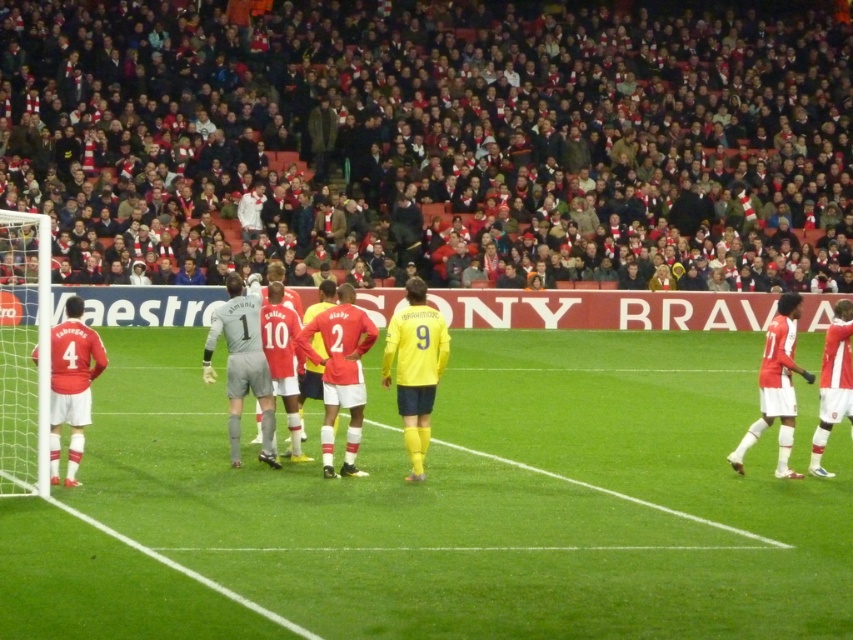
Question: Does red scarf at upper center have a greater width compared to yellow matte jersey at center?

Choices:
 (A) yes
 (B) no

Answer: (A)

Question: Which point is farther to the camera?

Choices:
 (A) green grass field at lower left
 (B) yellow matte jersey at center
 (C) white plastic goal at left

Answer: (B)

Question: Is white plastic goal at left thinner than yellow matte jersey at center?

Choices:
 (A) yes
 (B) no

Answer: (B)

Question: Does green grass field at lower left have a larger size compared to yellow matte jersey at center?

Choices:
 (A) yes
 (B) no

Answer: (A)

Question: Based on their relative distances, which object is nearer to the yellow matte jersey at center?

Choices:
 (A) green grass field at lower left
 (B) red scarf at upper center

Answer: (A)

Question: Which object is the closest to the white plastic goal at left?

Choices:
 (A) red scarf at upper center
 (B) green grass field at lower left

Answer: (B)